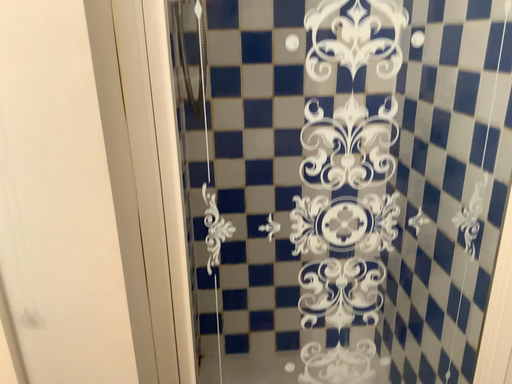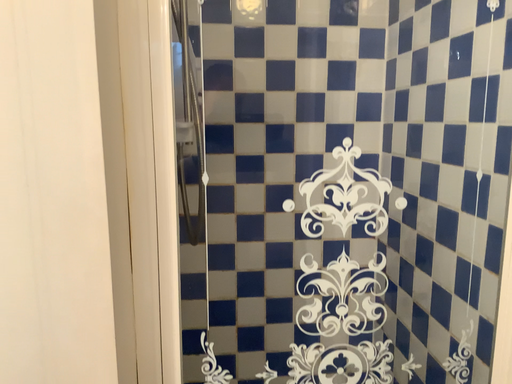
Question: How did the camera likely rotate when shooting the video?

Choices:
 (A) rotated upward
 (B) rotated downward

Answer: (A)